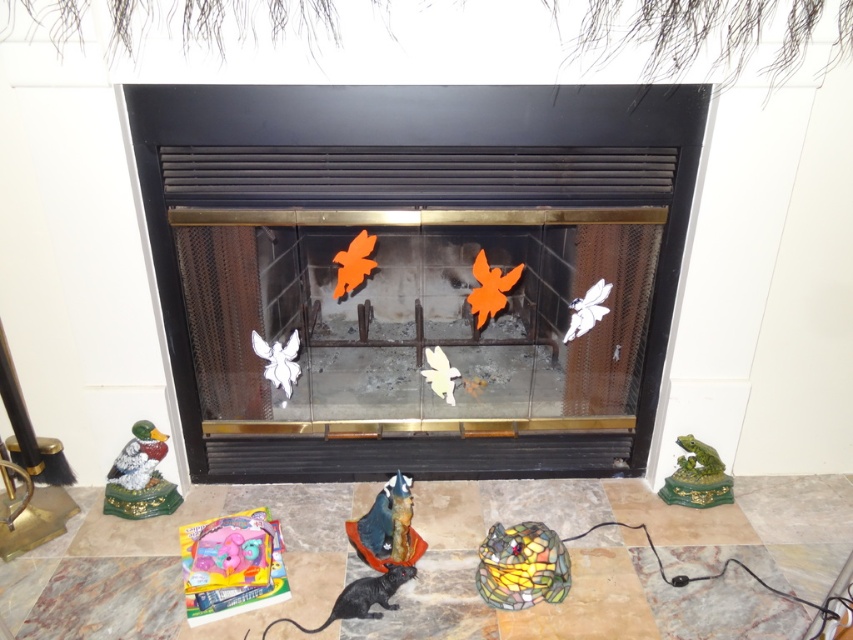
You are a child who wants to reach the white matte butterfly at center from the translucent plastic toy at lower left. Can you easily grab it if you are 3 feet away from the toy?

The distance between the translucent plastic toy at lower left and the white matte butterfly at center is 27.85 inches, which is approximately 2.32 feet. Since you are already 3 feet away from the toy, you are farther than the distance between them, so you cannot easily grab the butterfly.